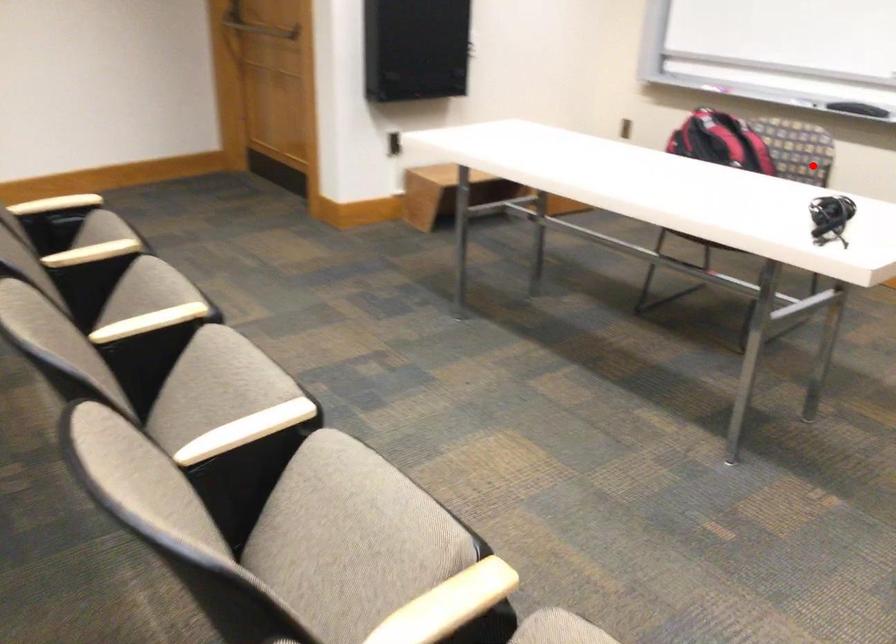
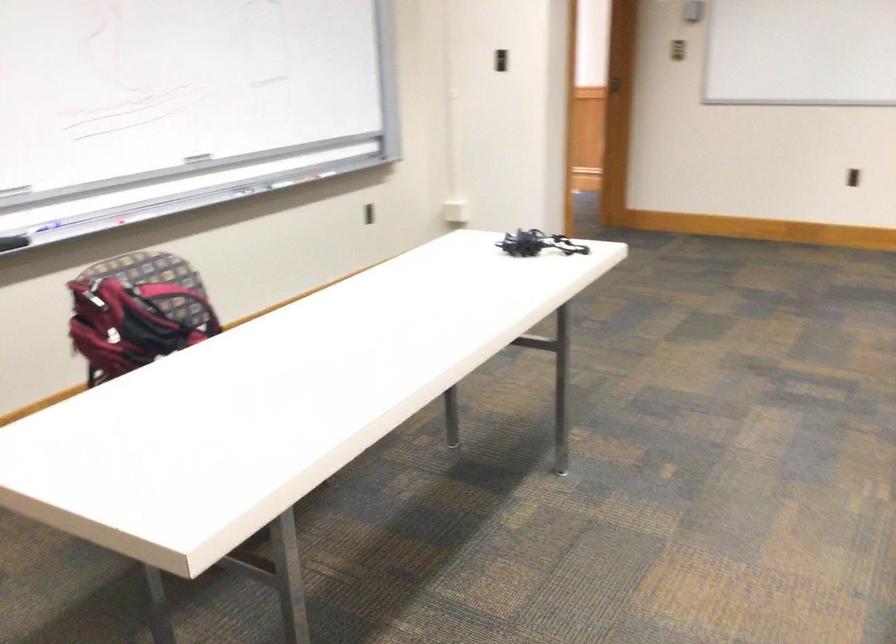
Question: I am providing you with two images of the same scene from different viewpoints. A red point is shown in image1. For the corresponding object point in image2, is it positioned nearer or farther from the camera?

Choices:
 (A) Nearer
 (B) Farther

Answer: (A)